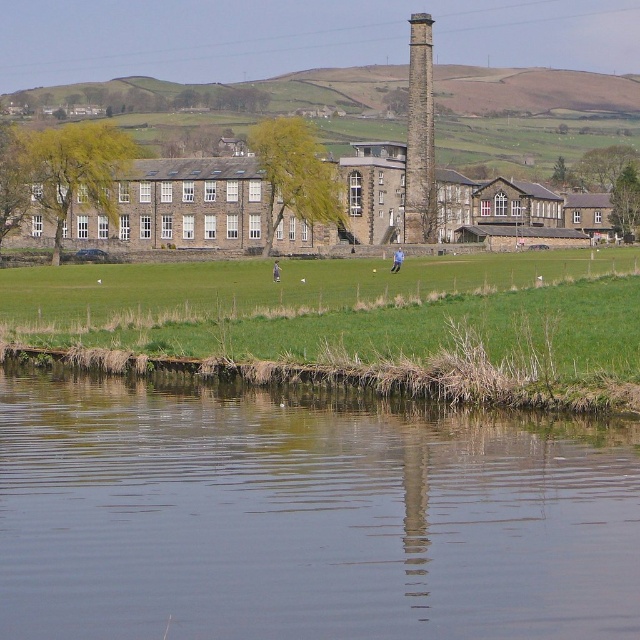
You are standing at point A in the image, which is located at coordinates (x=305, y=515). What is the object you are standing on?

You are standing on transparent water at lower center located at point (x=305, y=515).

You are standing at the edge of the transparent water at lower center and want to look up at the smooth stone chimney at upper center. In which direction should you turn your head?

You should turn your head to the right to look at the smooth stone chimney at upper center because the transparent water at lower center is to the left of it.